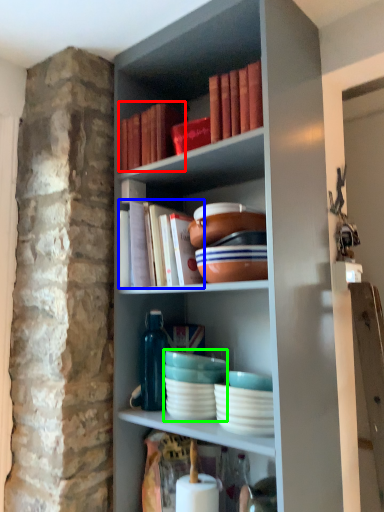
Question: Estimate the real-world distances between objects in this image. Which object is farther from book (highlighted by a red box), book (highlighted by a blue box) or tableware (highlighted by a green box)?

Choices:
 (A) book
 (B) tableware

Answer: (B)